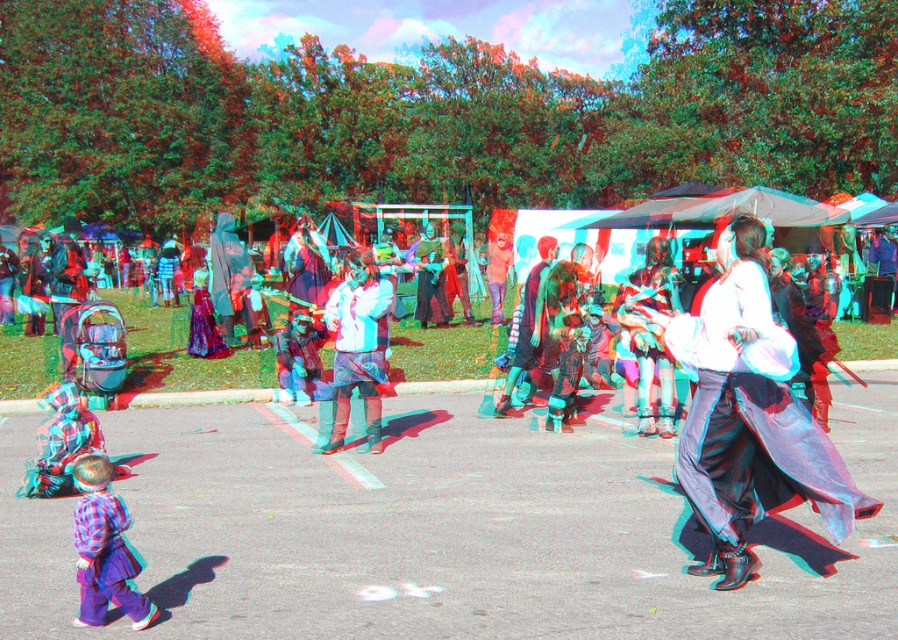
Who is higher up, white matte jacket at center or plaid fabric shirt at lower left?

white matte jacket at center is above.

Can you confirm if white matte jacket at center is positioned above plaid fabric shirt at lower left?

Yes.

Is point (376, 388) more distant than point (144, 612)?

Yes, point (376, 388) is farther from viewer.

Where is `white matte jacket at center`? white matte jacket at center is located at coordinates (358, 344).

Can you confirm if silky black dress at center is wider than plaid fabric shirt at lower left?

Yes.

Who is lower down, silky black dress at center or plaid fabric shirt at lower left?

plaid fabric shirt at lower left is below.

This screenshot has height=640, width=898. I want to click on silky black dress at center, so click(x=749, y=416).

Find the location of a particular element. The image size is (898, 640). silky black dress at center is located at coordinates (749, 416).

Does silky black dress at center have a greater width compared to white matte jacket at center?

Indeed, silky black dress at center has a greater width compared to white matte jacket at center.

Who is more forward, (782,435) or (354,321)?

Point (782,435) is more forward.

Between point (782, 403) and point (351, 378), which one is positioned behind?

Point (351, 378)

In order to click on silky black dress at center in this screenshot , I will do `click(749, 416)`.